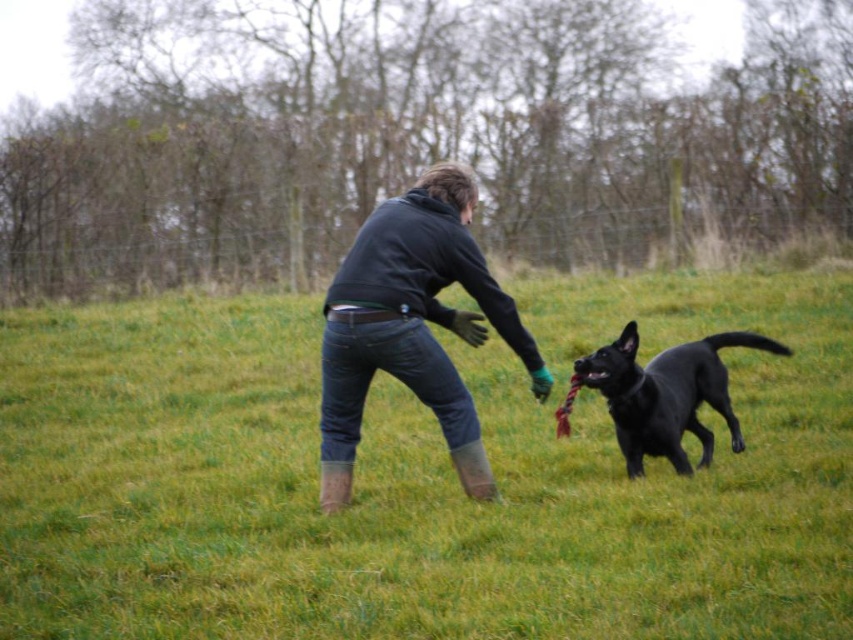
Question: Can you confirm if dark gray hoodie at center is positioned below black glossy dog at center?

Choices:
 (A) no
 (B) yes

Answer: (A)

Question: Among these points, which one is farthest from the camera?

Choices:
 (A) (233, 561)
 (B) (338, 326)

Answer: (B)

Question: Which point is closer to the camera taking this photo?

Choices:
 (A) (430, 352)
 (B) (148, 604)

Answer: (B)

Question: In this image, where is green grass at center located relative to dark gray hoodie at center?

Choices:
 (A) left
 (B) right

Answer: (B)

Question: Which object is farther from the camera taking this photo?

Choices:
 (A) dark gray hoodie at center
 (B) black glossy dog at center

Answer: (B)

Question: Can you confirm if green grass at center is thinner than dark gray hoodie at center?

Choices:
 (A) no
 (B) yes

Answer: (A)